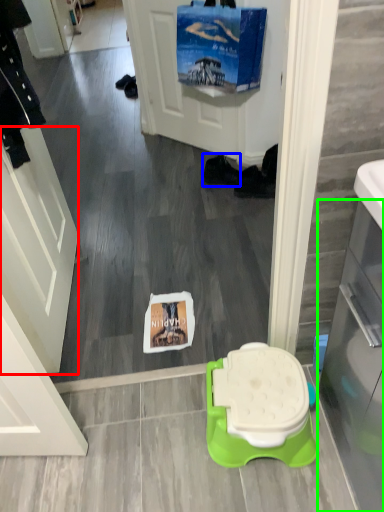
Question: Which object is the farthest from screen door (highlighted by a red box)? Choose among these: footwear (highlighted by a blue box) or glass door (highlighted by a green box).

Choices:
 (A) footwear
 (B) glass door

Answer: (A)